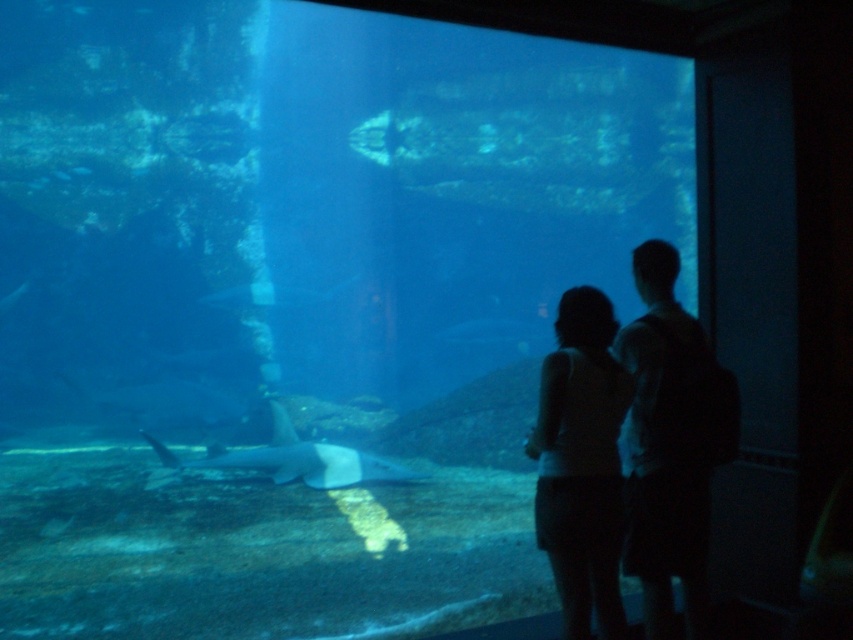
You are a tour guide at the aquarium and need to explain the relative sizes of the objects in the tank to a visitor. Which object is wider between the silhouette human at center and the silhouette fabric at center?

The silhouette human at center is wider than the silhouette fabric at center.

You are a tour guide at the aquarium and notice two visitors pointing at the tank. They ask if the silhouette human at center is standing on the silhouette fabric at center. What do you tell them?

The silhouette human at center is above the silhouette fabric at center, so they are not standing on it but positioned higher up relative to the fabric.

You are a visitor standing in front of the aquarium tank. You see a silhouette human at center and a silhouette fabric at center. Which object is closer to you?

The silhouette human at center is closer to you than the silhouette fabric at center.